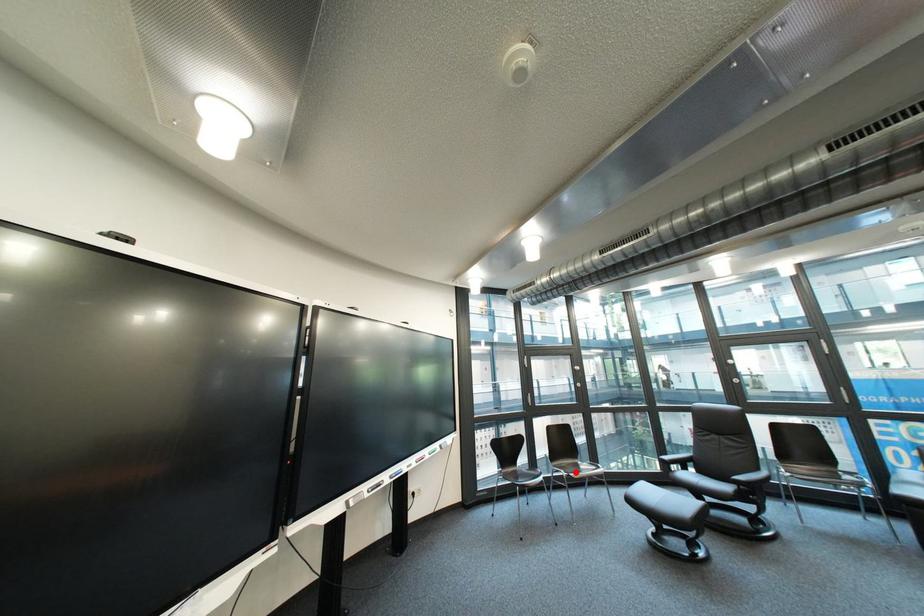
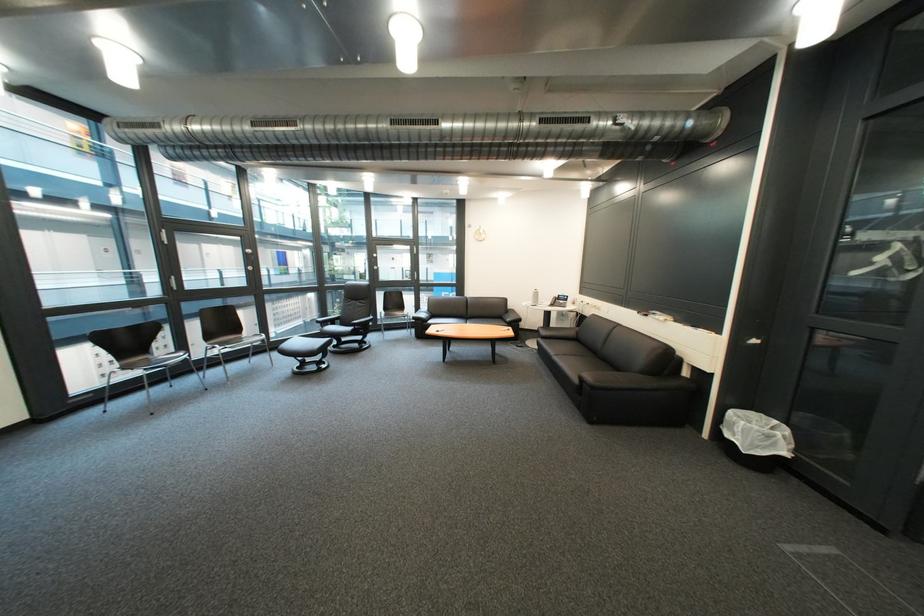
In the second image, find the point that corresponds to the highlighted location in the first image.

(229, 347)